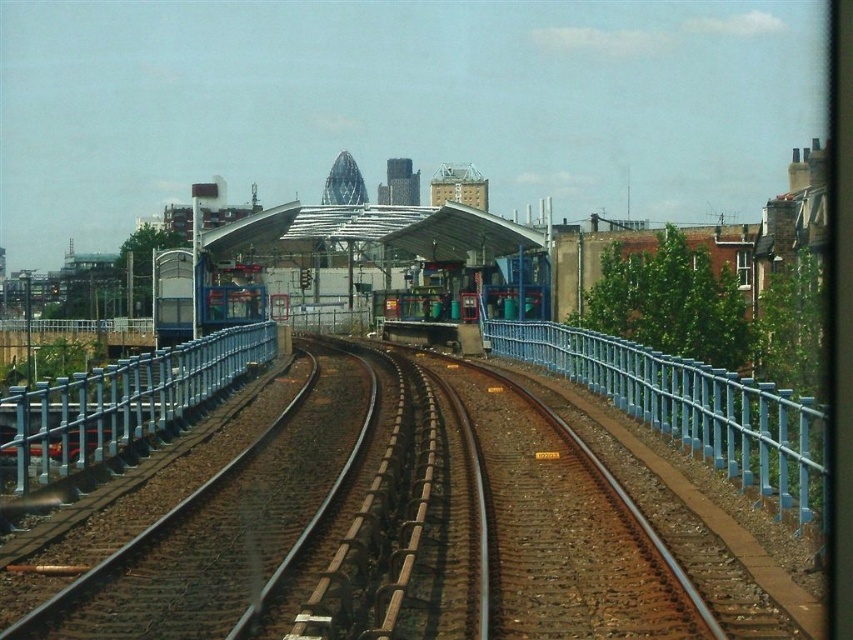
You are a passenger standing on the platform and want to know if you can easily walk between the metallic blue rail at center and the transparent glass railway station at center. Based on their widths, can you determine if there is enough space?

The metallic blue rail at center has a lesser width compared to the transparent glass railway station at center, so there should be enough space between them for walking.

You are a passenger sitting by the window of the train and you see the blue metallic rail at right and the metallic blue rail at center. Which one appears larger to you?

The blue metallic rail at right appears larger than the metallic blue rail at center because it is bigger in size.

You are a passenger sitting by the window of a moving train. You notice two objects outside your window, the blue metallic rail at right and the transparent glass railway station at center. Which object takes up more space in your view?

The transparent glass railway station at center takes up more space in your view because the blue metallic rail at right occupies less space than it.